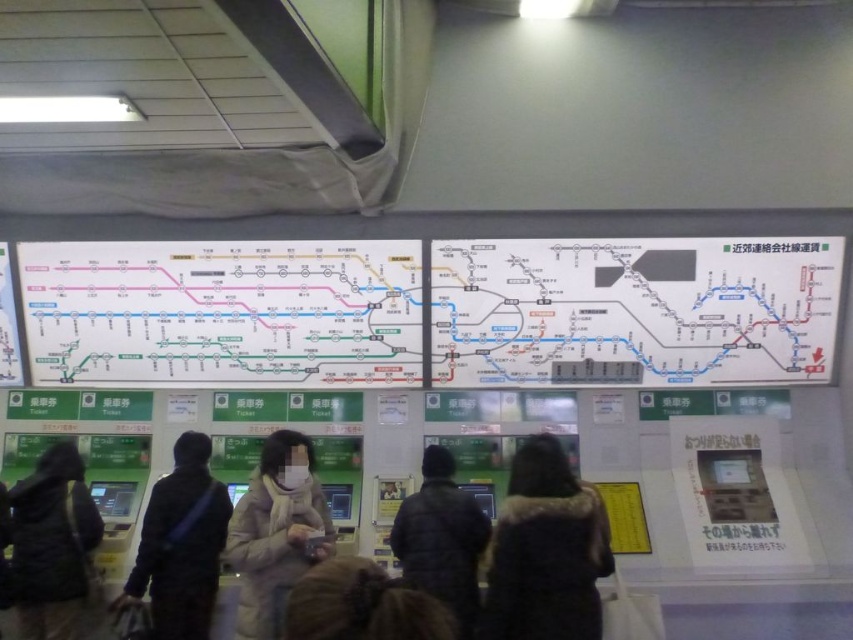
Does dark brown fur coat at center appear on the left side of dark gray jacket at center?

No, dark brown fur coat at center is not to the left of dark gray jacket at center.

Between dark brown fur coat at center and dark gray jacket at center, which one is positioned higher?

dark brown fur coat at center is higher up.

The height and width of the screenshot is (640, 853). In order to click on dark brown fur coat at center in this screenshot , I will do `click(544, 550)`.

This screenshot has width=853, height=640. I want to click on dark brown fur coat at center, so click(x=544, y=550).

Which is more to the left, dark gray jacket at center or dark brown hair at center?

Result: dark gray jacket at center is more to the left.

Does dark gray jacket at center appear under dark brown hair at center?

Yes.

Between point (189, 456) and point (323, 584), which one is positioned behind?

The point (189, 456) is more distant.

The image size is (853, 640). I want to click on dark gray jacket at center, so (181, 545).

Does white puffy coat at center have a smaller size compared to dark brown hair at center?

Actually, white puffy coat at center might be larger than dark brown hair at center.

Is point (277, 492) positioned before point (347, 589)?

No, (277, 492) is further to viewer.

I want to click on white puffy coat at center, so click(276, 532).